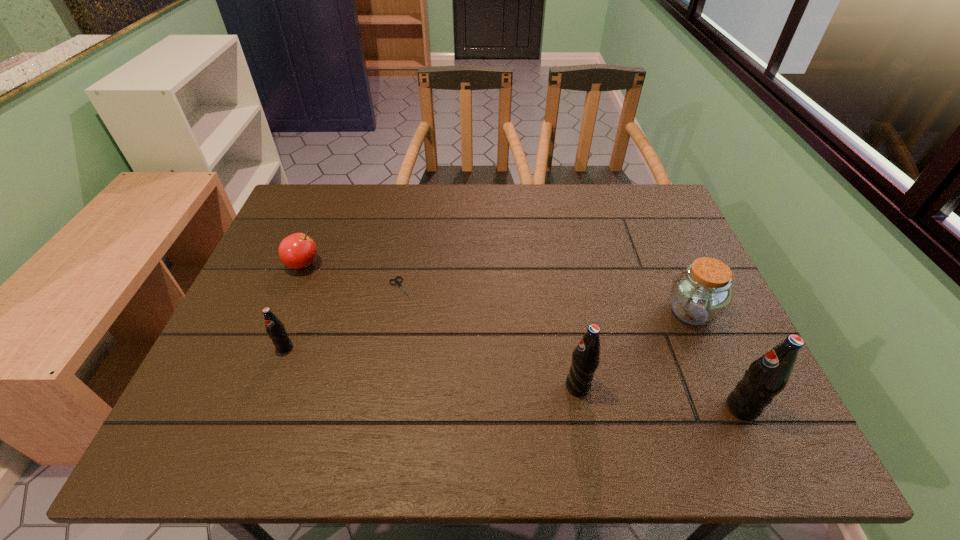
Find the location of a particular element. This screenshot has width=960, height=540. pop that is at the right edge is located at coordinates (767, 376).

Find the location of a particular element. jar present at the right edge is located at coordinates (700, 294).

You are a GUI agent. You are given a task and a screenshot of the screen. Output one action in this format:
    pyautogui.click(x=<x>, y=<y>)
    Task: Click on the object situated at the near right corner
    The height and width of the screenshot is (540, 960).
    Given the screenshot: What is the action you would take?
    pyautogui.click(x=767, y=376)

The width and height of the screenshot is (960, 540). What are the coordinates of `vacant space at the far edge of the desktop` in the screenshot? It's located at (493, 186).

At what (x,y) coordinates should I click in order to perform the action: click on free space at the near edge of the desktop. Please return your answer as a coordinate pair (x, y). Looking at the image, I should click on (471, 389).

In the image, there is a desktop. In order to click on vacant area at the left edge in this screenshot , I will do `click(300, 309)`.

I want to click on free space at the right edge, so click(669, 323).

In the image, there is a desktop. Where is `vacant space at the far left corner`? This screenshot has width=960, height=540. vacant space at the far left corner is located at coordinates (323, 199).

This screenshot has width=960, height=540. Identify the location of vacant space at the near left corner of the desktop. (245, 397).

Identify the location of free spot at the far right corner of the desktop. The height and width of the screenshot is (540, 960). (649, 201).